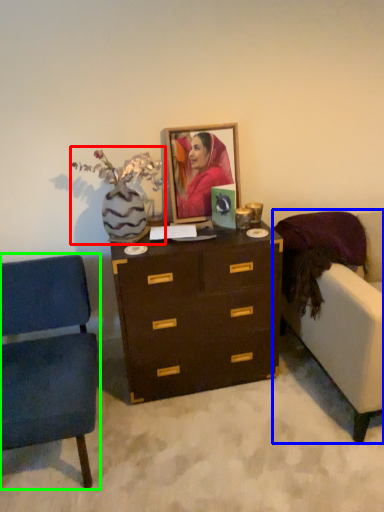
Question: Based on their relative distances, which object is nearer to floral arrangement (highlighted by a red box)? Choose from studio couch (highlighted by a blue box) and chair (highlighted by a green box).

Choices:
 (A) studio couch
 (B) chair

Answer: (B)